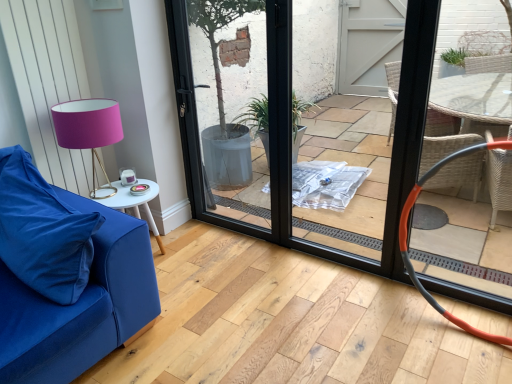
Question: From a real-world perspective, is black glass door at center physically located above or below matte gold table lamp at left?

Choices:
 (A) below
 (B) above

Answer: (B)

Question: Do you think black glass door at center is within matte gold table lamp at left, or outside of it?

Choices:
 (A) outside
 (B) inside

Answer: (A)

Question: Which object is the closest to the matte gold table lamp at left?

Choices:
 (A) orange rubber armchair at right
 (B) white glossy side table at lower left
 (C) velvety blue pillow at lower left
 (D) black glass door at center

Answer: (B)

Question: Which of these objects is positioned closest to the white glossy side table at lower left?

Choices:
 (A) matte gold table lamp at left
 (B) velvety blue pillow at lower left
 (C) orange rubber armchair at right
 (D) black glass door at center

Answer: (A)